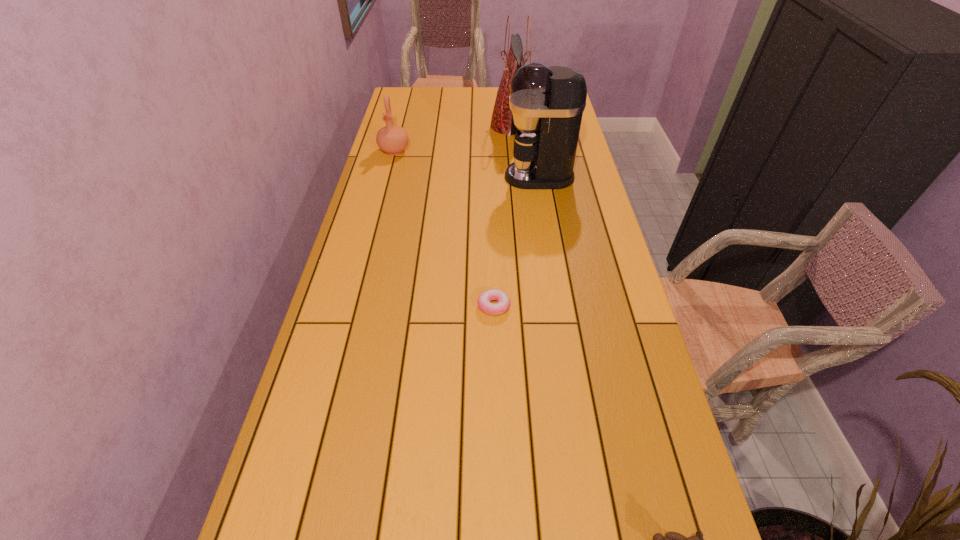
I want to click on empty space between the third nearest object and the fourth farthest object, so click(516, 241).

Where is `free space that is in between the third shortest object and the coffee maker`? The image size is (960, 540). free space that is in between the third shortest object and the coffee maker is located at coordinates (467, 164).

Where is `free spot between the shortest object and the leftmost object`? The image size is (960, 540). free spot between the shortest object and the leftmost object is located at coordinates (444, 228).

This screenshot has height=540, width=960. In order to click on vacant region between the handbag and the third shortest object in this screenshot , I will do `click(453, 138)`.

This screenshot has height=540, width=960. What are the coordinates of `the second closest object to the handbag` in the screenshot? It's located at (392, 139).

Choose which object is the fourth nearest neighbor to the handbag. Please provide its 2D coordinates. Your answer should be formatted as a tuple, i.e. [(x, y)], where the tuple contains the x and y coordinates of a point satisfying the conditions above.

[(673, 539)]

At what (x,y) coordinates should I click in order to perform the action: click on vacant space that satisfies the following two spatial constraints: 1. on the spout of the shortest object; 2. on the right side of the pottery. Please return your answer as a coordinate pair (x, y). The height and width of the screenshot is (540, 960). Looking at the image, I should click on (354, 306).